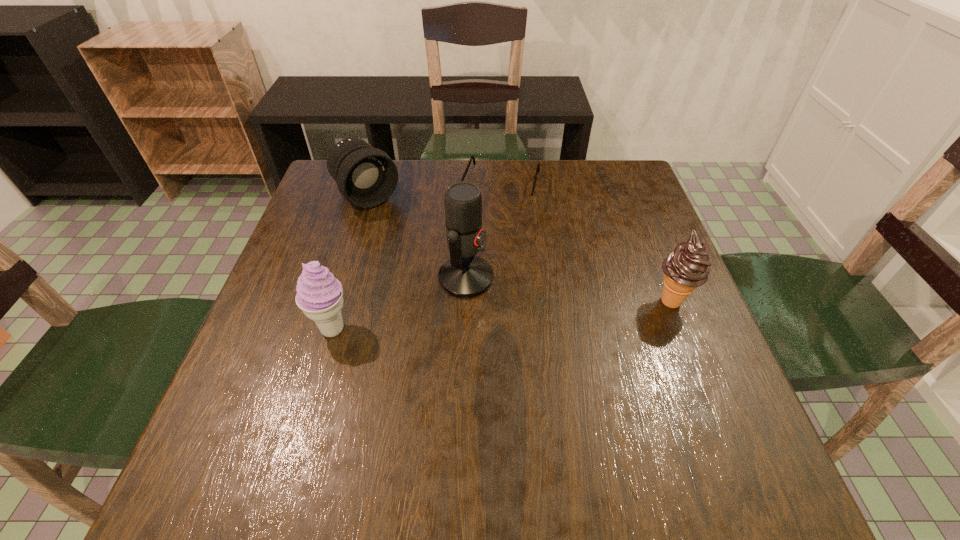
You are a GUI agent. You are given a task and a screenshot of the screen. Output one action in this format:
    pyautogui.click(x=<x>, y=<y>)
    Task: Click on the vacant region between the second shortest object and the left icecream
    This screenshot has width=960, height=540.
    Given the screenshot: What is the action you would take?
    pyautogui.click(x=350, y=262)

The image size is (960, 540). I want to click on vacant space that's between the right icecream and the shortest object, so click(587, 245).

I want to click on vacant area that lies between the shortest object and the right icecream, so click(x=587, y=245).

You are a GUI agent. You are given a task and a screenshot of the screen. Output one action in this format:
    pyautogui.click(x=<x>, y=<y>)
    Task: Click on the empty space that is in between the telephoto lens and the microphone
    Image resolution: width=960 pixels, height=540 pixels.
    Given the screenshot: What is the action you would take?
    pyautogui.click(x=417, y=237)

You are a GUI agent. You are given a task and a screenshot of the screen. Output one action in this format:
    pyautogui.click(x=<x>, y=<y>)
    Task: Click on the vacant point located between the rightmost object and the left icecream
    The height and width of the screenshot is (540, 960).
    Given the screenshot: What is the action you would take?
    pyautogui.click(x=502, y=315)

Locate an element on the screen. This screenshot has height=540, width=960. vacant point located between the microphone and the left icecream is located at coordinates (399, 303).

This screenshot has height=540, width=960. Find the location of `vacant space that is in between the left icecream and the right icecream`. vacant space that is in between the left icecream and the right icecream is located at coordinates (502, 315).

This screenshot has width=960, height=540. I want to click on empty space between the rightmost object and the spectacles, so click(x=587, y=245).

Select which object appears as the fourth closest to the tallest object. Please provide its 2D coordinates. Your answer should be formatted as a tuple, i.e. [(x, y)], where the tuple contains the x and y coordinates of a point satisfying the conditions above.

[(687, 267)]

Identify which object is the closest to the microphone. Please provide its 2D coordinates. Your answer should be formatted as a tuple, i.e. [(x, y)], where the tuple contains the x and y coordinates of a point satisfying the conditions above.

[(319, 295)]